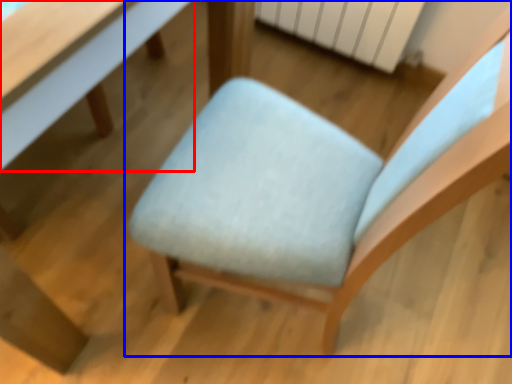
Question: Which object is further to the camera taking this photo, table (highlighted by a red box) or chair (highlighted by a blue box)?

Choices:
 (A) table
 (B) chair

Answer: (A)